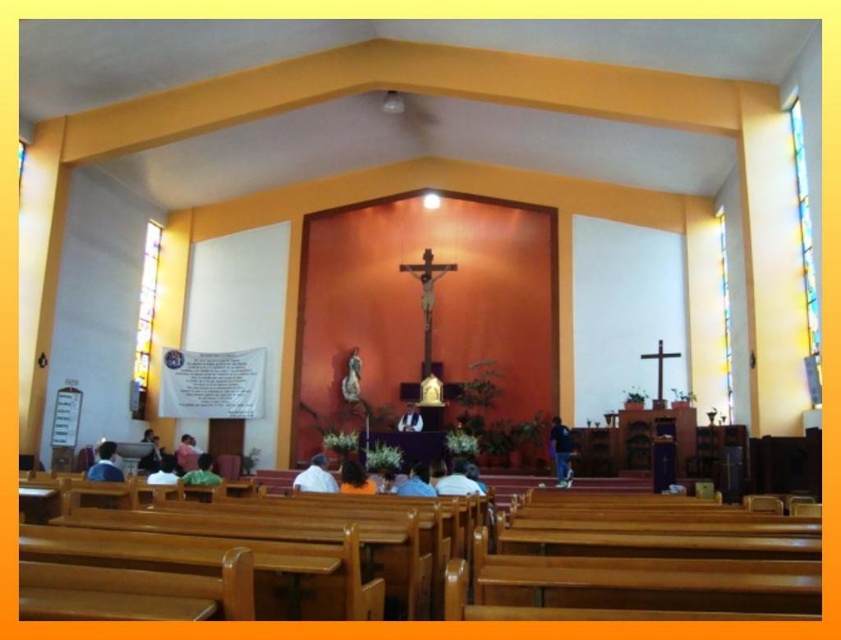
Is blue fabric shirt at lower left thinner than blue fabric shirt at center?

No.

Is blue fabric shirt at lower left bigger than blue fabric shirt at center?

Actually, blue fabric shirt at lower left might be smaller than blue fabric shirt at center.

Is point (98, 472) closer to camera compared to point (419, 477)?

That is False.

This screenshot has height=640, width=841. In order to click on blue fabric shirt at lower left in this screenshot , I will do `click(104, 465)`.

What do you see at coordinates (416, 483) in the screenshot? This screenshot has height=640, width=841. I see `blue fabric shirt at center` at bounding box center [416, 483].

Can you confirm if blue fabric shirt at center is bigger than white glossy statue at center?

Incorrect, blue fabric shirt at center is not larger than white glossy statue at center.

This screenshot has width=841, height=640. I want to click on blue fabric shirt at center, so click(416, 483).

From the picture: How much distance is there between white matte shirt at center and white fabric at center?

A distance of 9.78 feet exists between white matte shirt at center and white fabric at center.

Describe the element at coordinates (315, 476) in the screenshot. The height and width of the screenshot is (640, 841). I see `white matte shirt at center` at that location.

What do you see at coordinates (315, 476) in the screenshot?
I see `white matte shirt at center` at bounding box center [315, 476].

Locate an element on the screen. white matte shirt at center is located at coordinates (315, 476).